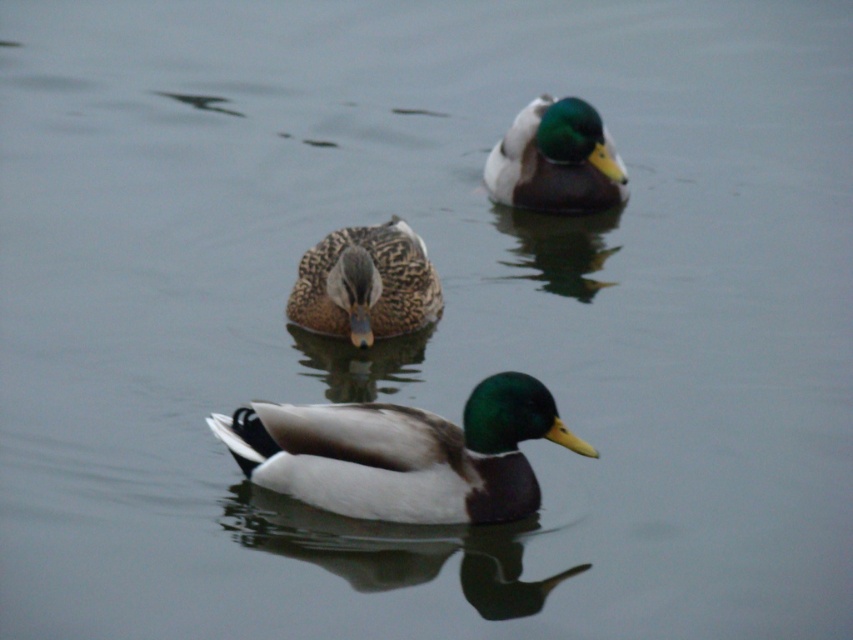
You are standing on the edge of the pond and see the shiny white duck at center. Where is the shiny white duck at center located relative to the point marked at coordinate (x=402, y=452)?

The shiny white duck at center is located exactly at the point marked at coordinate (x=402, y=452).

You are standing on the edge of the water and see the shiny white duck at center and the speckled feather duck at center. If you want to throw a small pebble to make a ripple that reaches both ducks at the same time, how far apart should you aim the pebble from each duck?

The shiny white duck at center and the speckled feather duck at center are 1.90 meters apart from each other. To make the ripple reach both ducks simultaneously, aim the pebble exactly halfway between them, which would be 0.95 meters from each duck.

You are observing the ducks in the scene. Which duck, the shiny white duck at center or the speckled feather duck at center, is shorter in height?

The shiny white duck at center is shorter than the speckled feather duck at center.